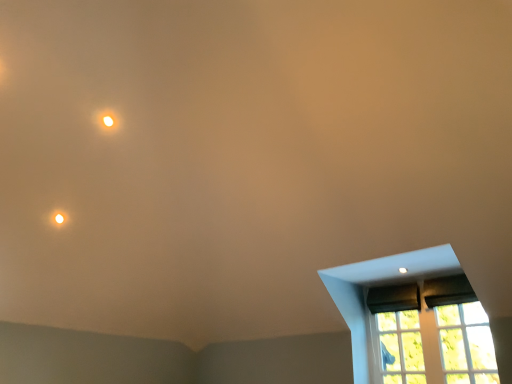
Question: Is matte white light at upper left bigger or smaller than transparent glass window at lower right, the first glass window when ordered from right to left?

Choices:
 (A) big
 (B) small

Answer: (B)

Question: Do you think matte white light at upper left is within transparent glass window at lower right, the second glass window positioned from the left, or outside of it?

Choices:
 (A) outside
 (B) inside

Answer: (A)

Question: Which of these objects is positioned farthest from the matte black window at lower right?

Choices:
 (A) matte white light at upper left
 (B) clear glass window at lower right, the first glass window when ordered from left to right
 (C) transparent glass window at lower right, the second glass window positioned from the left

Answer: (A)

Question: Which of these objects is positioned closest to the transparent glass window at lower right, the first glass window when ordered from right to left?

Choices:
 (A) matte white light at upper left
 (B) matte black window at lower right
 (C) clear glass window at lower right, the first glass window when ordered from left to right

Answer: (C)